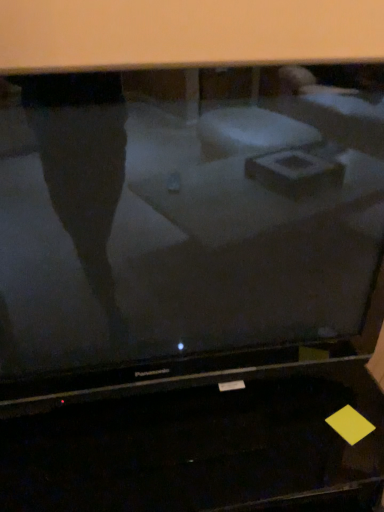
Question: Is black glossy desktop at lower center inside the boundaries of matte black television at center, or outside?

Choices:
 (A) outside
 (B) inside

Answer: (A)

Question: Based on their sizes in the image, would you say black glossy desktop at lower center is bigger or smaller than matte black television at center?

Choices:
 (A) small
 (B) big

Answer: (B)

Question: Is black glossy desktop at lower center in front of or behind matte black television at center in the image?

Choices:
 (A) behind
 (B) front

Answer: (A)

Question: Considering their positions, is matte black television at center located in front of or behind black glossy desktop at lower center?

Choices:
 (A) front
 (B) behind

Answer: (A)

Question: From a real-world perspective, is matte black television at center physically located above or below black glossy desktop at lower center?

Choices:
 (A) above
 (B) below

Answer: (A)

Question: Does point (193, 323) appear closer or farther from the camera than point (216, 503)?

Choices:
 (A) farther
 (B) closer

Answer: (A)

Question: Looking at the image, does matte black television at center seem bigger or smaller compared to black glossy desktop at lower center?

Choices:
 (A) small
 (B) big

Answer: (A)